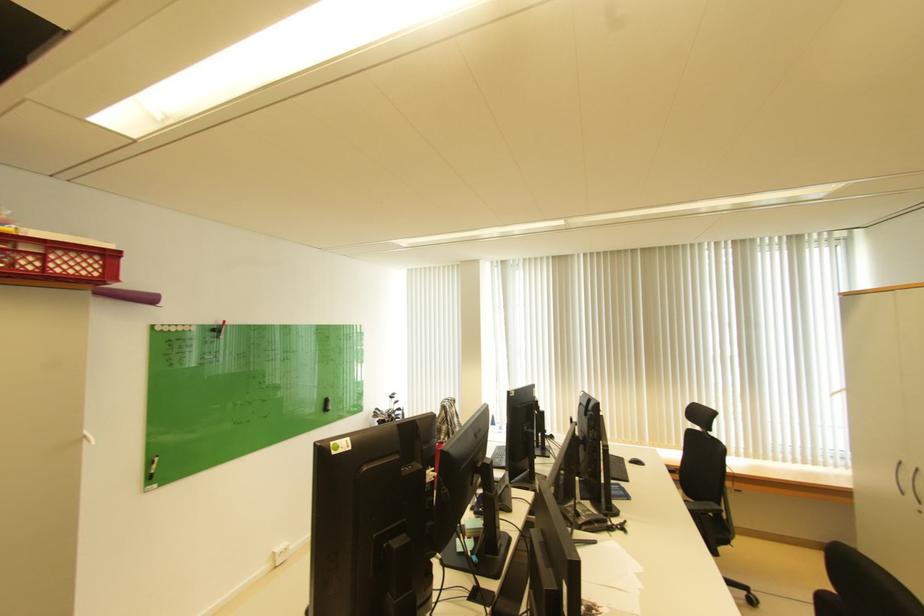
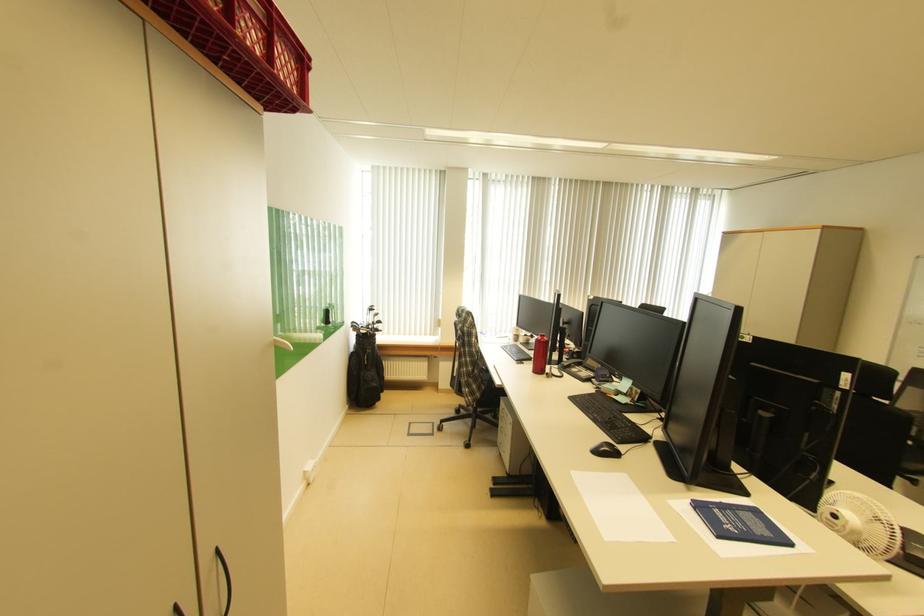
Question: What movement of the cameraman would produce the second image?

Choices:
 (A) Left
 (B) Right
 (C) Forward
 (D) Backward

Answer: (A)